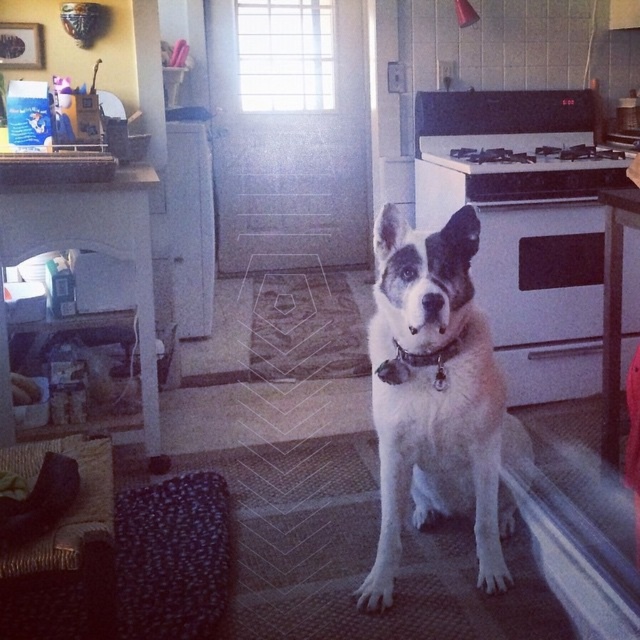
Question: Estimate the real-world distances between objects in this image. Which object is closer to the transparent glass screen door at center?

Choices:
 (A) white fur dog at center
 (B) white glossy oven at center right
 (C) black leather collar at center
 (D) matte black exhaust hood at upper center

Answer: (D)

Question: Does white glossy oven at center right have a lesser width compared to matte black exhaust hood at upper center?

Choices:
 (A) yes
 (B) no

Answer: (B)

Question: Observing the image, what is the correct spatial positioning of black leather collar at center in reference to matte black exhaust hood at upper center?

Choices:
 (A) left
 (B) right

Answer: (A)

Question: Is the position of white fur dog at center less distant than that of white glossy oven at center right?

Choices:
 (A) yes
 (B) no

Answer: (A)

Question: Which of these objects is positioned farthest from the white fur dog at center?

Choices:
 (A) transparent glass screen door at center
 (B) black leather collar at center

Answer: (A)

Question: Which point is closer to the camera taking this photo?

Choices:
 (A) (401, 353)
 (B) (589, 232)
 (C) (621, 29)
 (D) (474, 499)

Answer: (A)